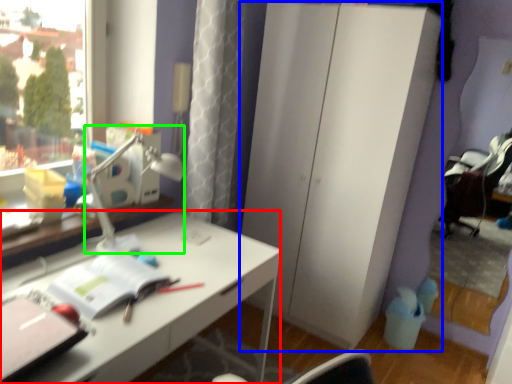
Question: Which object is positioned closest to desk (highlighted by a red box)? Select from dresser (highlighted by a blue box) and table lamp (highlighted by a green box).

Choices:
 (A) dresser
 (B) table lamp

Answer: (B)